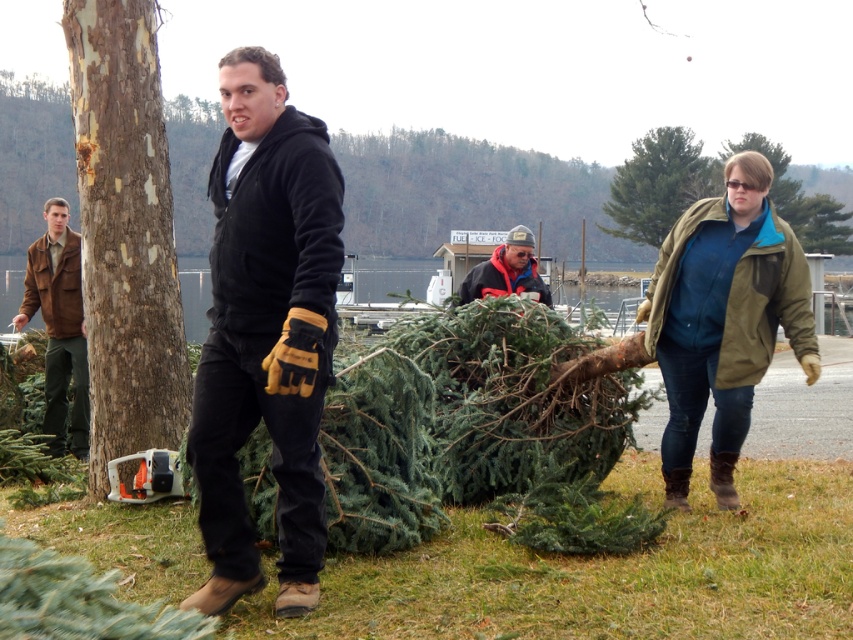
Can you confirm if green matte tree at upper right is wider than reddish-brown woolen jacket at center?

Correct, the width of green matte tree at upper right exceeds that of reddish-brown woolen jacket at center.

Can you confirm if green matte tree at upper right is shorter than reddish-brown woolen jacket at center?

Incorrect, green matte tree at upper right's height does not fall short of reddish-brown woolen jacket at center's.

Is point (672, 148) positioned behind point (519, 246)?

Yes, point (672, 148) is behind point (519, 246).

Image resolution: width=853 pixels, height=640 pixels. In order to click on green matte tree at upper right in this screenshot , I will do `click(659, 184)`.

Is brown suede jacket at left thinner than green matte tree at upper right?

Yes.

This screenshot has width=853, height=640. What do you see at coordinates (59, 326) in the screenshot?
I see `brown suede jacket at left` at bounding box center [59, 326].

The width and height of the screenshot is (853, 640). In order to click on brown suede jacket at left in this screenshot , I will do `click(59, 326)`.

Between smooth brown bark at left and green matte tree at upper right, which one appears on the right side from the viewer's perspective?

From the viewer's perspective, green matte tree at upper right appears more on the right side.

Between smooth brown bark at left and green matte tree at upper right, which one has more height?

green matte tree at upper right is taller.

Identify the location of smooth brown bark at left. Image resolution: width=853 pixels, height=640 pixels. (125, 232).

Where is `smooth brown bark at left`? The image size is (853, 640). smooth brown bark at left is located at coordinates (125, 232).